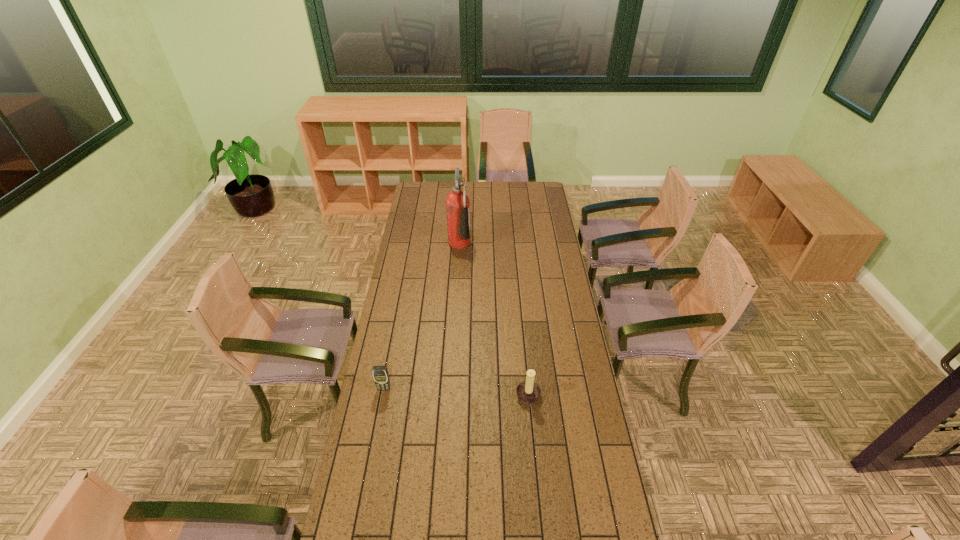
Find the location of a particular element. Image resolution: width=960 pixels, height=540 pixels. object that is at the left edge is located at coordinates (380, 373).

The width and height of the screenshot is (960, 540). In order to click on free space at the far edge of the desktop in this screenshot , I will do `click(445, 192)`.

Identify the location of vacant point at the left edge. (426, 208).

Image resolution: width=960 pixels, height=540 pixels. Find the location of `free point at the right edge`. free point at the right edge is located at coordinates [x=558, y=346].

The height and width of the screenshot is (540, 960). I want to click on vacant space at the far right corner of the desktop, so click(x=535, y=193).

This screenshot has width=960, height=540. I want to click on empty space between the rightmost object and the cellular telephone, so click(456, 394).

I want to click on empty location between the leftmost object and the rightmost object, so click(x=456, y=394).

This screenshot has height=540, width=960. I want to click on unoccupied position between the tallest object and the shortest object, so click(421, 316).

Select which object is the closest to the candle holder. Please provide its 2D coordinates. Your answer should be formatted as a tuple, i.e. [(x, y)], where the tuple contains the x and y coordinates of a point satisfying the conditions above.

[(380, 373)]

Where is `object that is the nearest to the shortest object`? The image size is (960, 540). object that is the nearest to the shortest object is located at coordinates (529, 392).